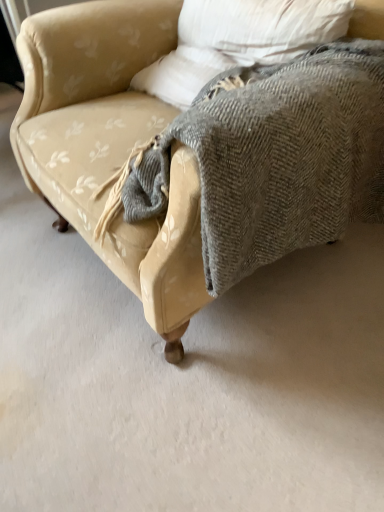
Locate an element on the screen. matte beige couch at center is located at coordinates (111, 146).

What do you see at coordinates (111, 146) in the screenshot?
I see `matte beige couch at center` at bounding box center [111, 146].

The height and width of the screenshot is (512, 384). Find the location of `matte beige couch at center`. matte beige couch at center is located at coordinates (111, 146).